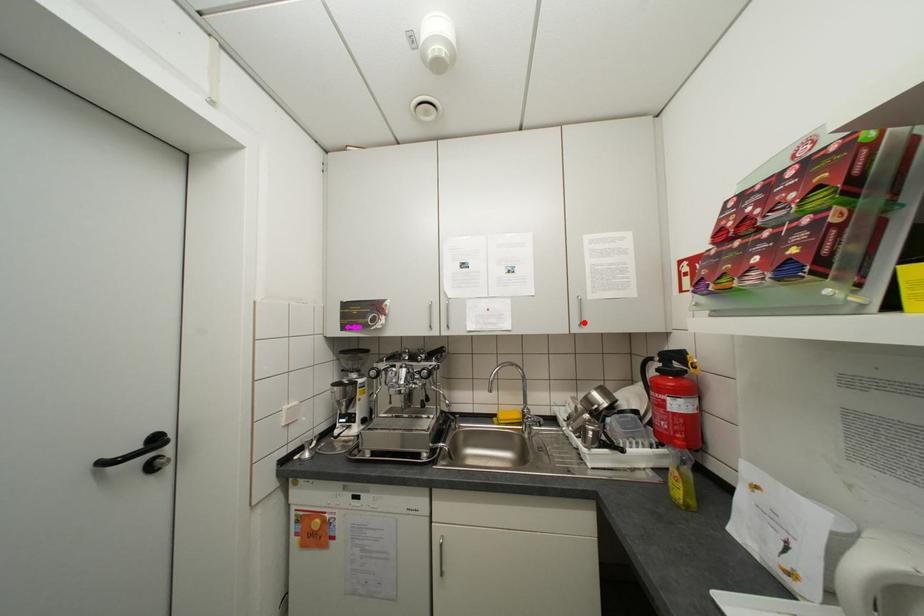
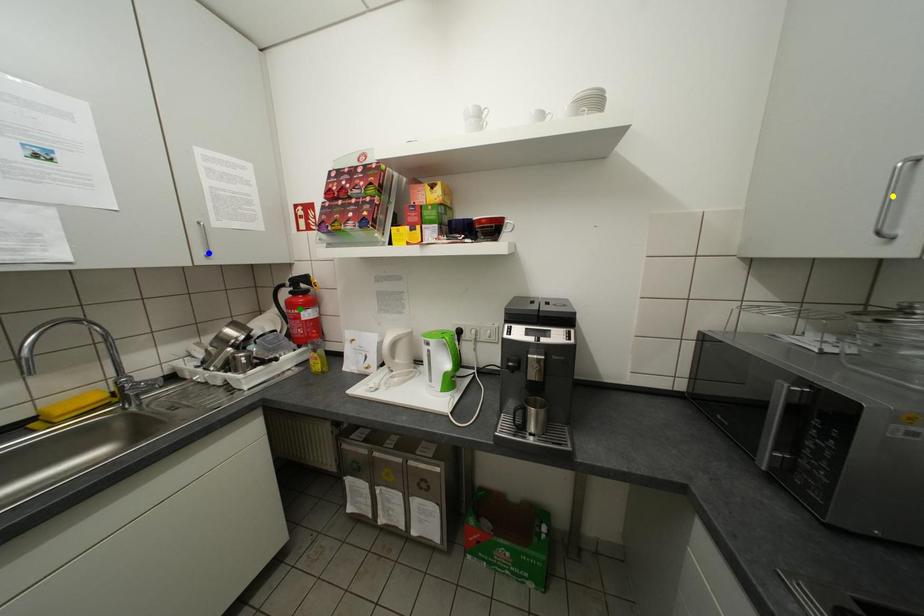
Question: I am providing you with two images of the same scene from different viewpoints. A red point is marked on the first image. You are given multiple points on the second image. In image 2, which mark is for the same physical point as the one in image 1?

Choices:
 (A) yellow point
 (B) green point
 (C) blue point

Answer: (C)